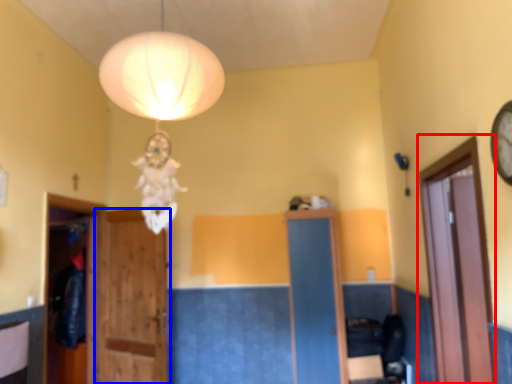
Question: Which point is closer to the camera, glass door (highlighted by a red box) or door (highlighted by a blue box)?

Choices:
 (A) glass door
 (B) door

Answer: (A)